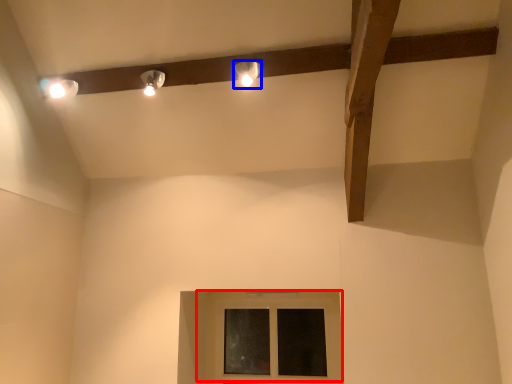
Question: Which object is closer to the camera taking this photo, window (highlighted by a red box) or lamp (highlighted by a blue box)?

Choices:
 (A) window
 (B) lamp

Answer: (B)